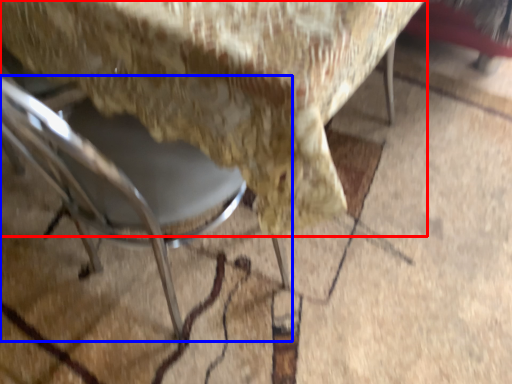
Question: Which object is closer to the camera taking this photo, chair (highlighted by a red box) or chair (highlighted by a blue box)?

Choices:
 (A) chair
 (B) chair

Answer: (B)